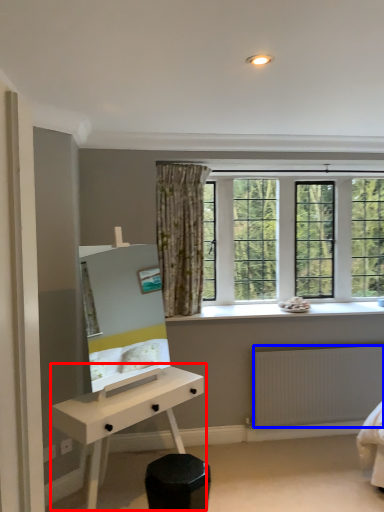
Question: Which of the following is the farthest to the observer, desk (highlighted by a red box) or radiator (highlighted by a blue box)?

Choices:
 (A) desk
 (B) radiator

Answer: (B)